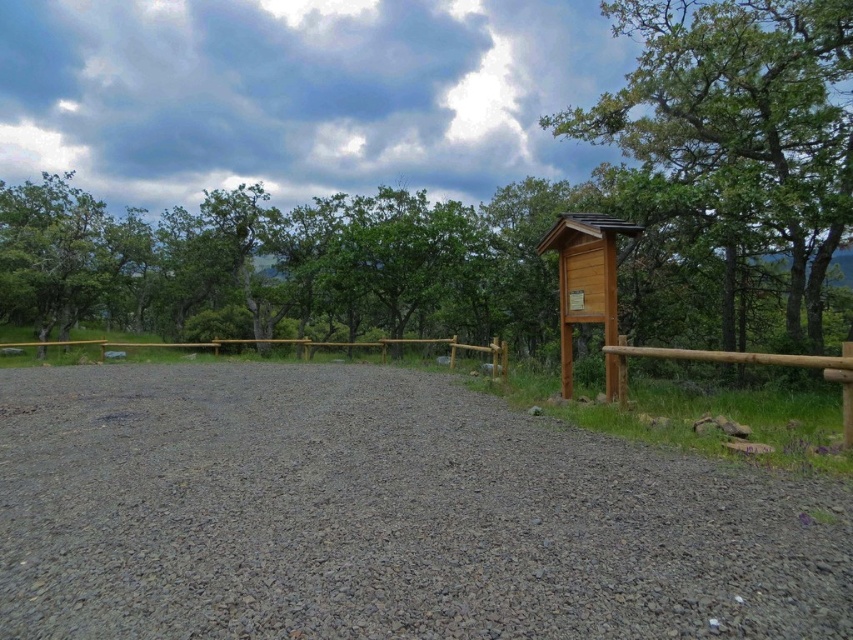
You are a hiker walking along the gravel path and see the wooden sign at upper right and the brown wooden fence at center. Which object is closer to you?

Result: The wooden sign at upper right is closer to you because the brown wooden fence at center is behind it.

You are a hiker who wants to place a small 10cm by 10cm marker on the ground. Which object from the scene can accommodate it without overlapping? Please choose between the gray gravel at center and the wooden sign at upper right.

The gray gravel at center is bigger than the wooden sign at upper right, so the marker can be placed on the gray gravel at center without overlapping.